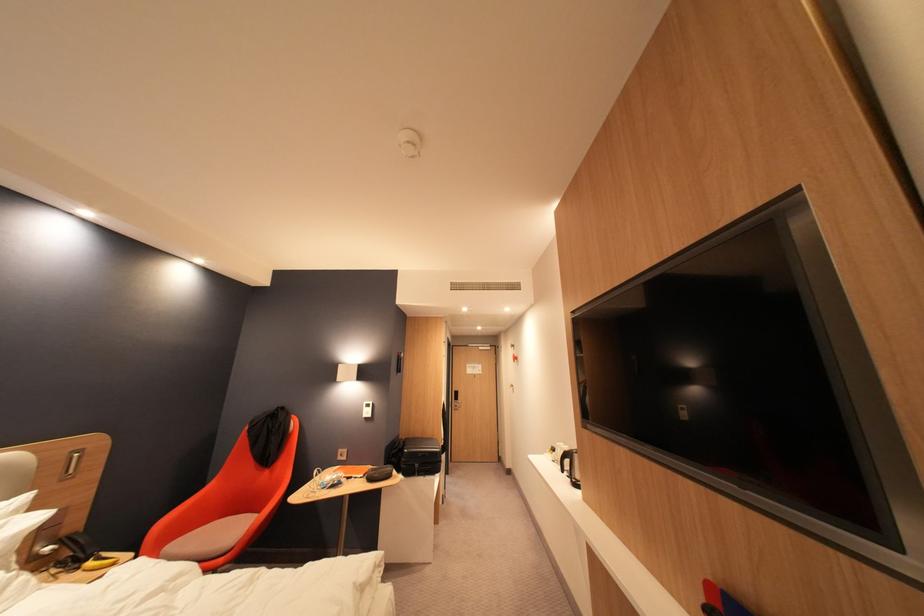
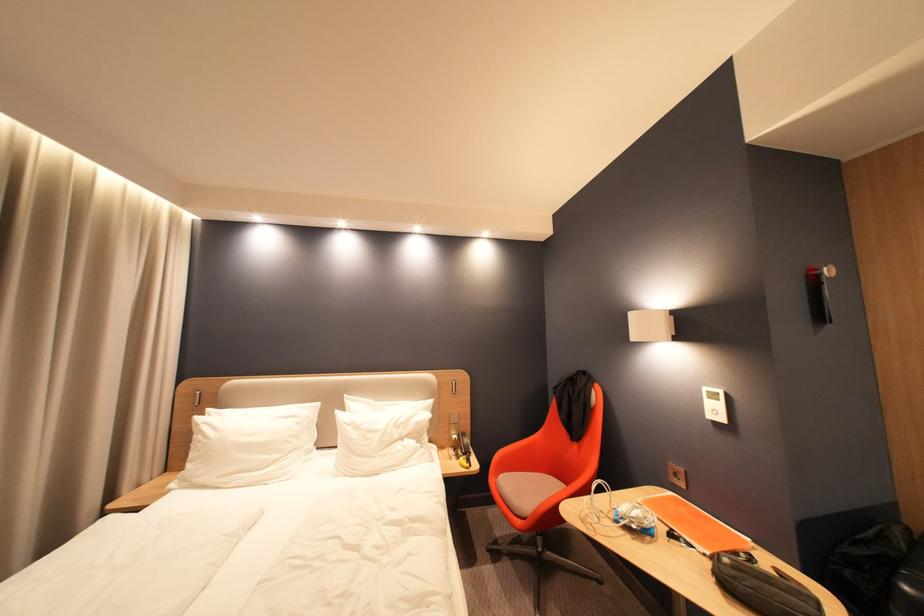
Where in the second image is the point corresponding to [369,475] from the first image?

(710, 544)